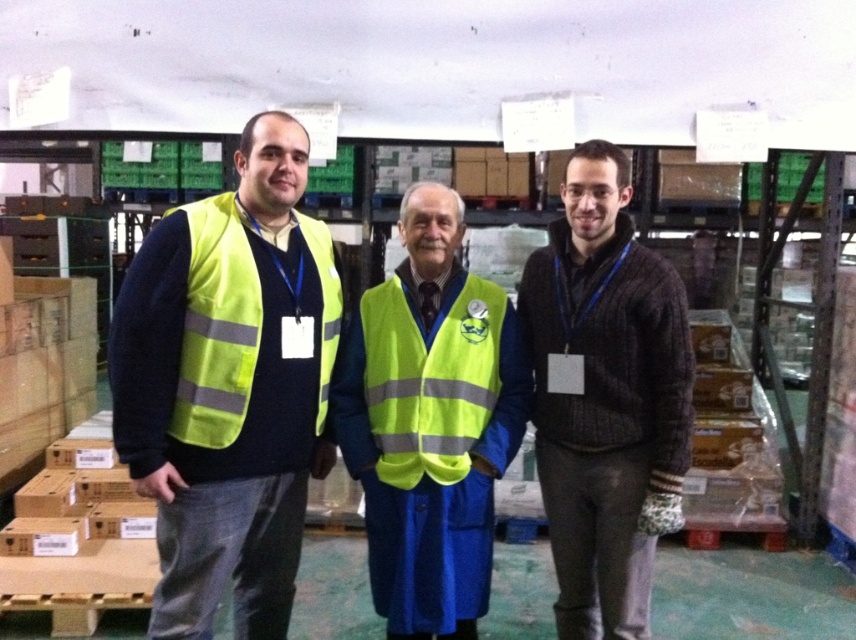
Question: Which is farther from the high-visibility fabric safety vest at center?

Choices:
 (A) high-visibility fabric vest at center
 (B) knitted sweater at center
 (C) yellow reflective vest at center
 (D) high-visibility fabric safety vest at left

Answer: (C)

Question: Does yellow reflective vest at center appear on the left side of knitted sweater at center?

Choices:
 (A) yes
 (B) no

Answer: (A)

Question: Which of the following is the farthest from the observer?

Choices:
 (A) (455, 596)
 (B) (250, 532)
 (C) (396, 304)

Answer: (C)

Question: Is yellow reflective vest at center further to the viewer compared to high-visibility fabric safety vest at left?

Choices:
 (A) yes
 (B) no

Answer: (B)

Question: Which object is positioned closest to the yellow reflective vest at center?

Choices:
 (A) high-visibility fabric safety vest at center
 (B) high-visibility fabric safety vest at left

Answer: (B)

Question: Is yellow reflective vest at center wider than knitted sweater at center?

Choices:
 (A) no
 (B) yes

Answer: (B)